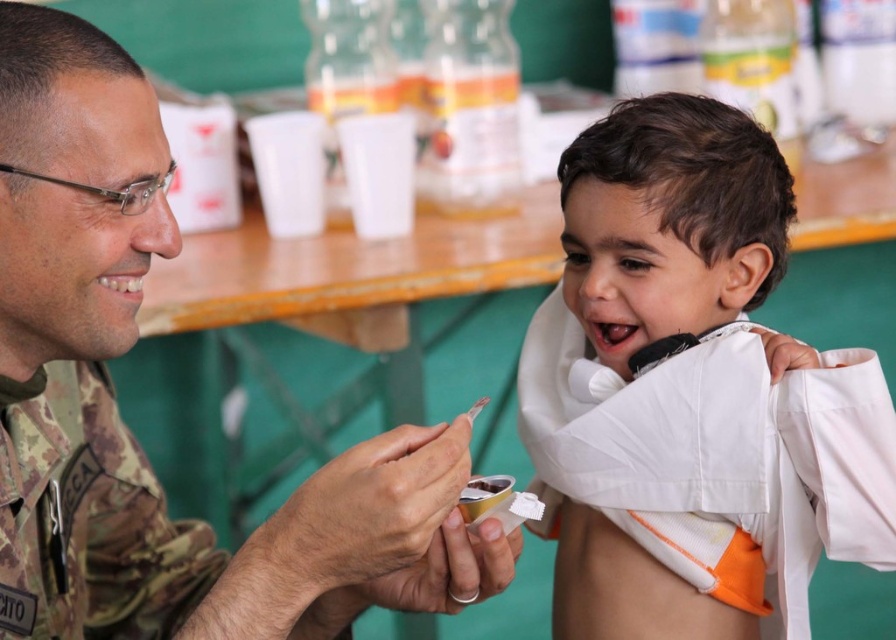
Question: Which of the following is the closest to the observer?

Choices:
 (A) camouflage uniform at left
 (B) camo fabric uniform at left

Answer: (A)

Question: Where is white cotton shirt at center located in relation to camo fabric uniform at left in the image?

Choices:
 (A) right
 (B) left

Answer: (A)

Question: Does white cotton shirt at center appear under camouflage uniform at left?

Choices:
 (A) no
 (B) yes

Answer: (B)

Question: Does white cotton shirt at center appear under camouflage uniform at left?

Choices:
 (A) no
 (B) yes

Answer: (B)

Question: Based on their relative distances, which object is farther from the camo fabric uniform at left?

Choices:
 (A) camouflage uniform at left
 (B) white cotton shirt at center

Answer: (B)

Question: Among these objects, which one is farthest from the camera?

Choices:
 (A) camo fabric uniform at left
 (B) camouflage uniform at left
 (C) white cotton shirt at center

Answer: (C)